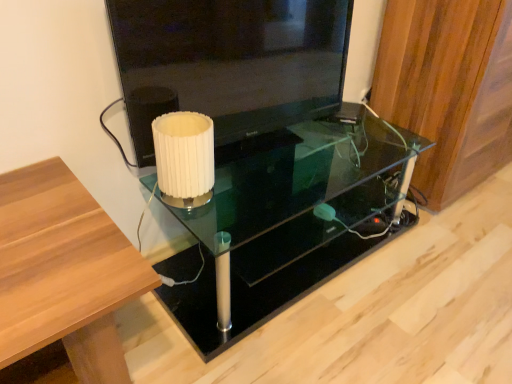
What are the coordinates of `white pleated paper at center` in the screenshot? It's located at (184, 158).

This screenshot has width=512, height=384. What do you see at coordinates (229, 63) in the screenshot?
I see `black glossy television at upper center` at bounding box center [229, 63].

Locate an element on the screen. The height and width of the screenshot is (384, 512). white pleated paper at center is located at coordinates (184, 158).

How different are the orientations of black glossy television at upper center and wooden panel at right in degrees?

The angle between the facing direction of black glossy television at upper center and the facing direction of wooden panel at right is 10.5 degrees.

Is black glossy television at upper center aimed at wooden panel at right?

No, black glossy television at upper center is not oriented towards wooden panel at right.

Is black glossy television at upper center situated inside wooden panel at right or outside?

black glossy television at upper center cannot be found inside wooden panel at right.

Measure the distance from black glossy television at upper center to wooden panel at right.

22.40 inches.

Are white pleated paper at center and wooden panel at right making contact?

white pleated paper at center is not next to wooden panel at right, and they're not touching.

How different are the orientations of white pleated paper at center and wooden panel at right in degrees?

There is a 6.46-degree angle between the facing directions of white pleated paper at center and wooden panel at right.

Can you confirm if white pleated paper at center is shorter than wooden panel at right?

Yes.

Which is behind, point (170, 165) or point (442, 164)?

The point (442, 164) is more distant.

Is white pleated paper at center next to black glossy television at upper center and touching it?

No, white pleated paper at center is not next to black glossy television at upper center.

How many degrees apart are the facing directions of white pleated paper at center and black glossy television at upper center?

They differ by 4.01 degrees in their facing directions.

From the image's perspective, is white pleated paper at center below black glossy television at upper center?

Result: Yes, from the image's perspective, white pleated paper at center is below black glossy television at upper center.

Is white pleated paper at center completely or partially outside of black glossy television at upper center?

Yes, white pleated paper at center is located beyond the bounds of black glossy television at upper center.

Is wooden panel at right next to transparent glass table at center?

No, wooden panel at right is not with transparent glass table at center.

Which object is further away from the camera taking this photo, wooden panel at right or transparent glass table at center?

wooden panel at right is behind.

Identify the location of table located below the wooden panel at right (from the image's perspective). (293, 218).

Is transparent glass table at center completely or partially inside white pleated paper at center?

No, transparent glass table at center is not surrounded by white pleated paper at center.

Are white pleated paper at center and transparent glass table at center making contact?

No, white pleated paper at center is not making contact with transparent glass table at center.

Considering the sizes of objects white pleated paper at center and transparent glass table at center in the image provided, who is thinner, white pleated paper at center or transparent glass table at center?

With smaller width is white pleated paper at center.

Is transparent glass table at center at the back of white pleated paper at center?

No, white pleated paper at center is not facing the opposite direction of transparent glass table at center.

Considering the relative positions of transparent glass table at center and white pleated paper at center in the image provided, is transparent glass table at center to the left of white pleated paper at center from the viewer's perspective?

No.

Can you confirm if transparent glass table at center is smaller than white pleated paper at center?

No.

Is transparent glass table at center shorter than white pleated paper at center?

No.

Considering the points (297, 128) and (201, 136), which point is in front, point (297, 128) or point (201, 136)?

The point (201, 136) is closer.

Does point (279, 8) lie behind point (167, 181)?

Yes, point (279, 8) is behind point (167, 181).

Is black glossy television at upper center facing away from white pleated paper at center?

Yes.

The image size is (512, 384). I want to click on table lamp behind the black glossy television at upper center, so click(x=184, y=158).

Considering the positions of objects black glossy television at upper center and white pleated paper at center in the image provided, who is more to the right, black glossy television at upper center or white pleated paper at center?

black glossy television at upper center is more to the right.

Image resolution: width=512 pixels, height=384 pixels. Identify the location of wood below the black glossy television at upper center (from a real-world perspective). (448, 88).

This screenshot has height=384, width=512. I want to click on table lamp below the wooden panel at right (from the image's perspective), so click(184, 158).

Considering their positions, is black glossy television at upper center positioned closer to wooden panel at right than transparent glass table at center?

transparent glass table at center is positioned closer to the anchor wooden panel at right.

When comparing their distances from transparent glass table at center, does white pleated paper at center or black glossy television at upper center seem closer?

Based on the image, black glossy television at upper center appears to be nearer to transparent glass table at center.

When comparing their distances from white pleated paper at center, does wooden panel at right or black glossy television at upper center seem closer?

Among the two, black glossy television at upper center is located nearer to white pleated paper at center.

Which object lies further to the anchor point wooden panel at right, white pleated paper at center or transparent glass table at center?

white pleated paper at center.

When comparing their distances from white pleated paper at center, does black glossy television at upper center or transparent glass table at center seem closer?

black glossy television at upper center lies closer to white pleated paper at center than the other object.

Based on their spatial positions, is transparent glass table at center or wooden panel at right further from white pleated paper at center?

Among the two, wooden panel at right is located further to white pleated paper at center.

Considering their positions, is wooden panel at right positioned further to black glossy television at upper center than white pleated paper at center?

Among the two, wooden panel at right is located further to black glossy television at upper center.

Estimate the real-world distances between objects in this image. Which object is closer to transparent glass table at center, white pleated paper at center or wooden panel at right?

wooden panel at right.

You are a GUI agent. You are given a task and a screenshot of the screen. Output one action in this format:
    pyautogui.click(x=<x>, y=<y>)
    Task: Click on the table lamp between black glossy television at upper center and transparent glass table at center in the vertical direction
    
    Given the screenshot: What is the action you would take?
    (x=184, y=158)

What are the coordinates of `table situated between black glossy television at upper center and wooden panel at right from left to right` in the screenshot? It's located at (293, 218).

Find the location of a particular element. The width and height of the screenshot is (512, 384). table between white pleated paper at center and wooden panel at right in the horizontal direction is located at coordinates (293, 218).

Locate an element on the screen. This screenshot has width=512, height=384. television situated between white pleated paper at center and wooden panel at right from left to right is located at coordinates (229, 63).